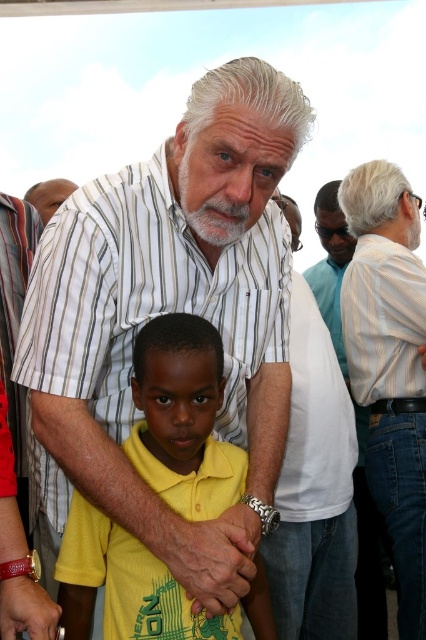
Question: Among these objects, which one is farthest from the camera?

Choices:
 (A) white striped shirt at center
 (B) yellow matte shirt at center
 (C) light blue striped shirt at upper right
 (D) white striped shirt at upper right

Answer: (C)

Question: Is yellow matte shirt at center wider than light blue striped shirt at upper right?

Choices:
 (A) yes
 (B) no

Answer: (A)

Question: Does light blue striped shirt at upper right appear on the right side of matte white shirt at upper left?

Choices:
 (A) no
 (B) yes

Answer: (B)

Question: Does white striped shirt at center come behind matte white shirt at upper left?

Choices:
 (A) no
 (B) yes

Answer: (A)

Question: Which point is closer to the camera?

Choices:
 (A) (385, 449)
 (B) (54, 212)
 (C) (161, 512)

Answer: (C)

Question: Considering the real-world distances, which object is farthest from the light blue striped shirt at upper right?

Choices:
 (A) white striped shirt at center
 (B) white striped shirt at upper right
 (C) yellow matte shirt at center

Answer: (C)